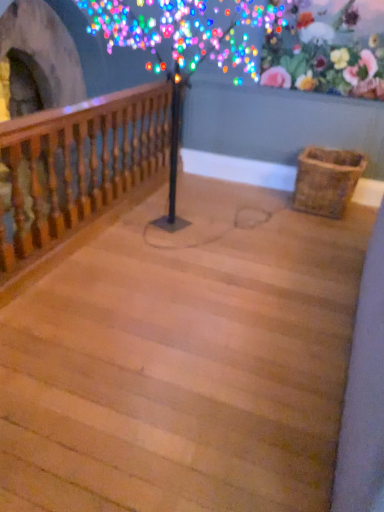
Question: Considering the positions of point (114, 173) and point (342, 164), is point (114, 173) closer or farther from the camera than point (342, 164)?

Choices:
 (A) farther
 (B) closer

Answer: (B)

Question: Which is correct: wooden baluster at left is inside woven brown basket at lower right, or outside of it?

Choices:
 (A) outside
 (B) inside

Answer: (A)

Question: Which is farther from the wooden baluster at left?

Choices:
 (A) floral fabric at upper right
 (B) woven brown basket at lower right
 (C) wooden stairs at center

Answer: (B)

Question: Estimate the real-world distances between objects in this image. Which object is closer to the wooden stairs at center?

Choices:
 (A) woven brown basket at lower right
 (B) wooden baluster at left
 (C) floral fabric at upper right

Answer: (B)